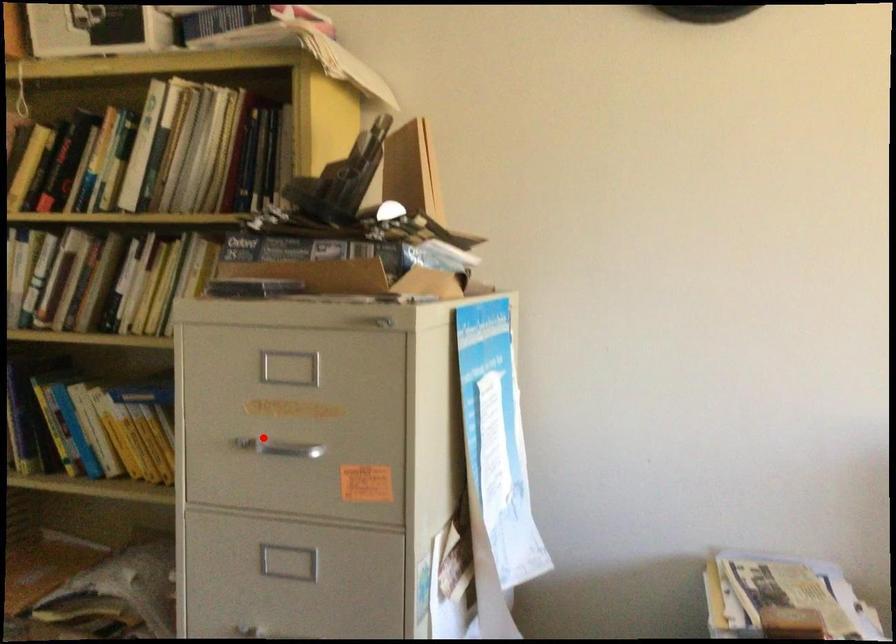
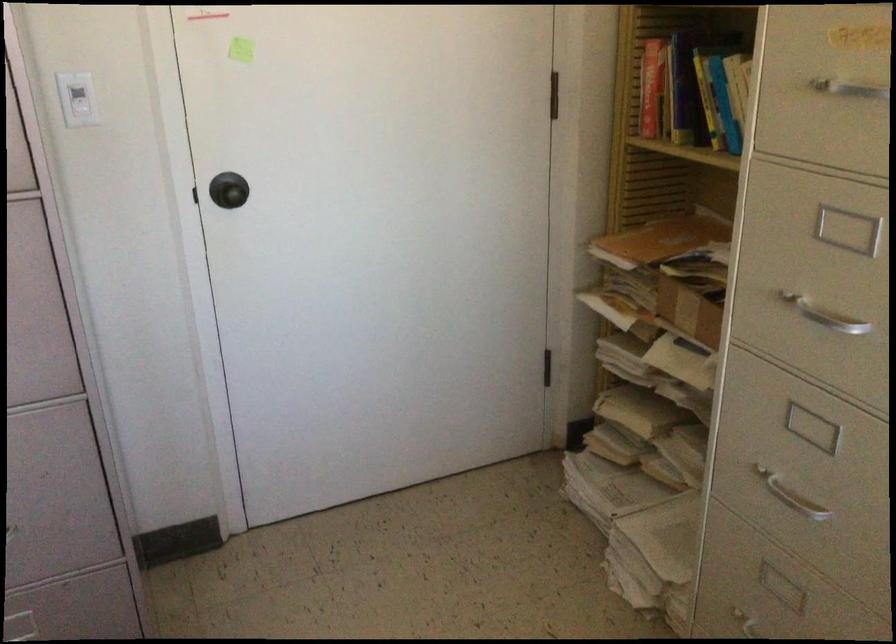
The point at the highlighted location is marked in the first image. Where is the corresponding point in the second image?

(839, 82)